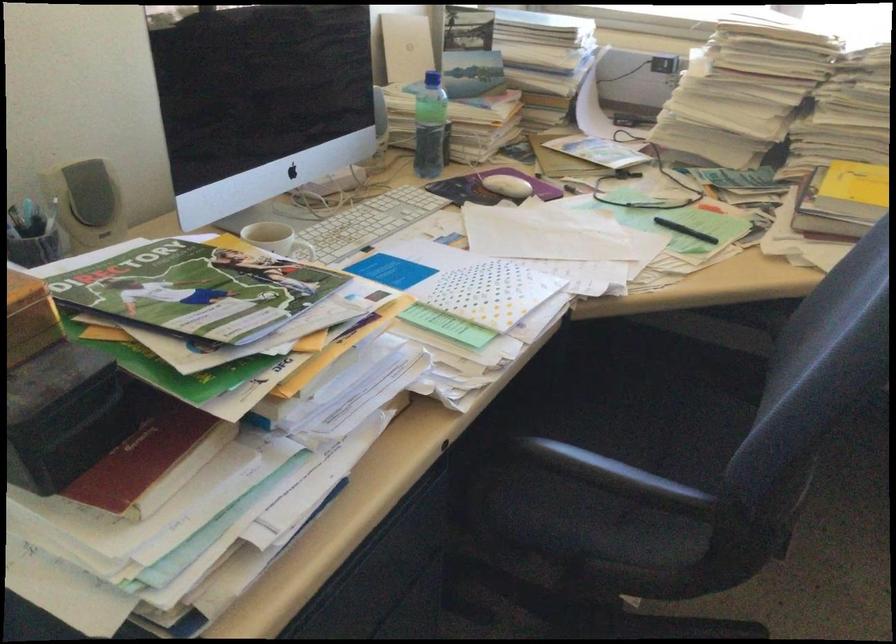
Identify the location of black eyeglasses. This screenshot has height=644, width=896. (610, 166).